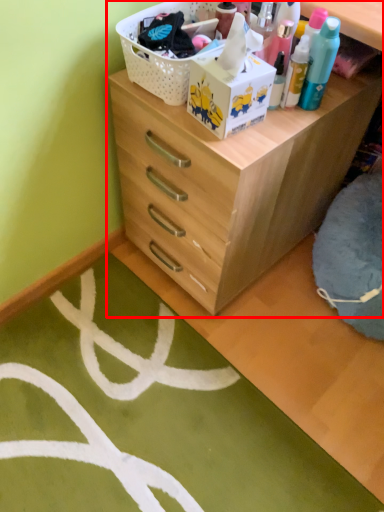
Question: From the image, what is the correct spatial relationship of chest of drawers (annotated by the red box) in relation to basket?

Choices:
 (A) left
 (B) right

Answer: (B)